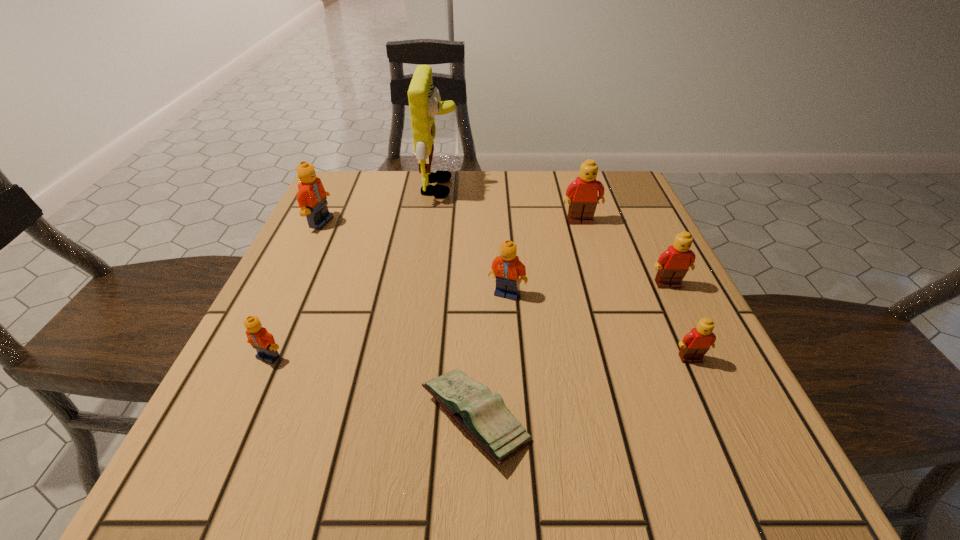
Identify the location of free space between the sponge and the smallest brown Lego. The height and width of the screenshot is (540, 960). (565, 273).

Identify which object is the second nearest to the third Lego from right to left. Please provide its 2D coordinates. Your answer should be formatted as a tuple, i.e. [(x, y)], where the tuple contains the x and y coordinates of a point satisfying the conditions above.

[(507, 267)]

You are a GUI agent. You are given a task and a screenshot of the screen. Output one action in this format:
    pyautogui.click(x=<x>, y=<y>)
    Task: Click on the object that ranks as the fourth closest to the pink diary
    
    Given the screenshot: What is the action you would take?
    tap(673, 264)

The image size is (960, 540). Find the location of `Lego that is the closest one to the nearest brown Lego`. Lego that is the closest one to the nearest brown Lego is located at coordinates (673, 264).

Locate which Lego is the fourth closest to the second smallest brown Lego. Please provide its 2D coordinates. Your answer should be formatted as a tuple, i.e. [(x, y)], where the tuple contains the x and y coordinates of a point satisfying the conditions above.

[(258, 336)]

Where is `orange Lego that is the nearest to the farthest brown Lego`? The image size is (960, 540). orange Lego that is the nearest to the farthest brown Lego is located at coordinates (507, 267).

This screenshot has width=960, height=540. Identify the location of the third closest orange Lego to the farthest object. click(258, 336).

Where is `brown Lego identified as the second closest to the smallest brown Lego`? The image size is (960, 540). brown Lego identified as the second closest to the smallest brown Lego is located at coordinates (582, 193).

Identify which brown Lego is located as the second nearest to the smallest brown Lego. Please provide its 2D coordinates. Your answer should be formatted as a tuple, i.e. [(x, y)], where the tuple contains the x and y coordinates of a point satisfying the conditions above.

[(582, 193)]

Locate an element on the screen. The height and width of the screenshot is (540, 960). vacant space that satisfies the following two spatial constraints: 1. on the front-facing side of the shortest object; 2. on the right side of the farthest orange Lego is located at coordinates (227, 418).